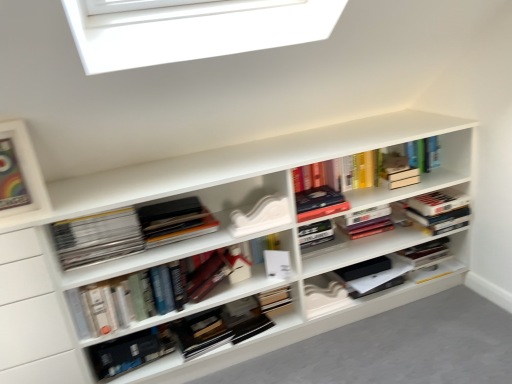
Question: Is hardcover book at center, arranged as the 5th book when viewed from the right, facing towards hardcover books at center, arranged as the sixth book when viewed from the left?

Choices:
 (A) yes
 (B) no

Answer: (B)

Question: Is hardcover book at center, which is the second book from left to right, turned away from hardcover books at center, acting as the first book starting from the right?

Choices:
 (A) yes
 (B) no

Answer: (B)

Question: Is hardcover book at center, arranged as the 5th book when viewed from the right, to the right of hardcover books at center, arranged as the sixth book when viewed from the left, from the viewer's perspective?

Choices:
 (A) no
 (B) yes

Answer: (A)

Question: Does hardcover book at center, arranged as the 5th book when viewed from the right, lie in front of hardcover books at center, acting as the first book starting from the right?

Choices:
 (A) no
 (B) yes

Answer: (B)

Question: Is hardcover book at center, which is the second book from left to right, to the left of hardcover books at center, arranged as the sixth book when viewed from the left, from the viewer's perspective?

Choices:
 (A) no
 (B) yes

Answer: (B)

Question: From the image's perspective, is hardcover book at center, which is the second book from left to right, on top of hardcover books at center, acting as the first book starting from the right?

Choices:
 (A) yes
 (B) no

Answer: (B)

Question: Is hardcover books at center, arranged as the sixth book when viewed from the left, placed right next to hardcover books at center, which is the 3th book in right-to-left order?

Choices:
 (A) yes
 (B) no

Answer: (B)

Question: Considering the relative sizes of hardcover books at center, acting as the first book starting from the right, and hardcover books at center, which is the 3th book in right-to-left order, in the image provided, is hardcover books at center, acting as the first book starting from the right, bigger than hardcover books at center, which is the 3th book in right-to-left order,?

Choices:
 (A) yes
 (B) no

Answer: (B)

Question: Can you confirm if hardcover books at center, acting as the first book starting from the right, is positioned to the left of hardcover books at center, which is the 3th book in right-to-left order?

Choices:
 (A) no
 (B) yes

Answer: (A)

Question: Is hardcover books at center, acting as the first book starting from the right, positioned with its back to hardcover books at center, the 4th book from the left?

Choices:
 (A) yes
 (B) no

Answer: (B)

Question: Considering the relative sizes of hardcover books at center, acting as the first book starting from the right, and hardcover books at center, the 4th book from the left, in the image provided, is hardcover books at center, acting as the first book starting from the right, taller than hardcover books at center, the 4th book from the left,?

Choices:
 (A) no
 (B) yes

Answer: (B)

Question: Is hardcover books at center, arranged as the sixth book when viewed from the left, not near hardcover books at center, which is the 3th book in right-to-left order?

Choices:
 (A) yes
 (B) no

Answer: (B)

Question: Is hardcover books at center, the 4th book from the left, turned away from hardcover book at center, arranged as the 5th book when viewed from the right?

Choices:
 (A) no
 (B) yes

Answer: (A)